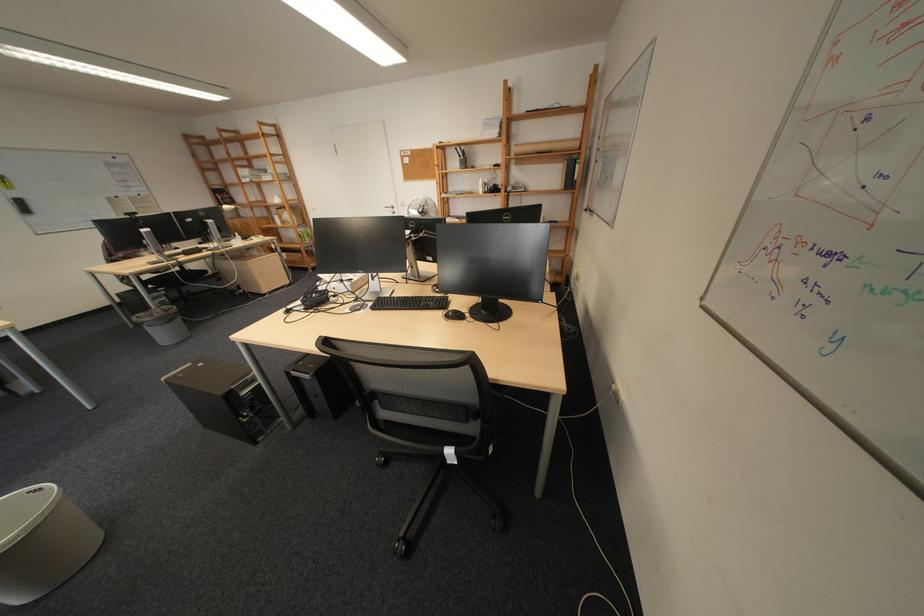
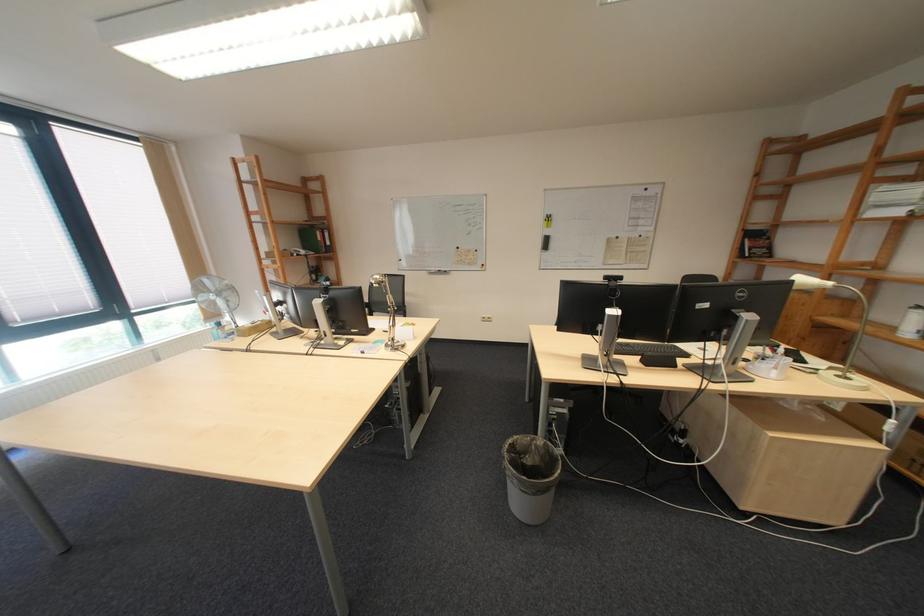
Find the pixel in the second image that matches the point at 152,315 in the first image.

(529, 439)